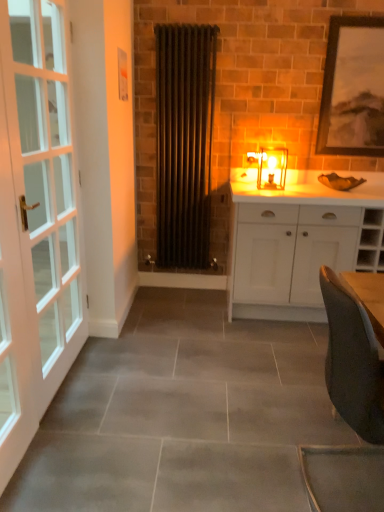
Find the location of a particular element. Image resolution: width=384 pixels, height=512 pixels. free location in front of matte glass candlestick at center is located at coordinates (279, 189).